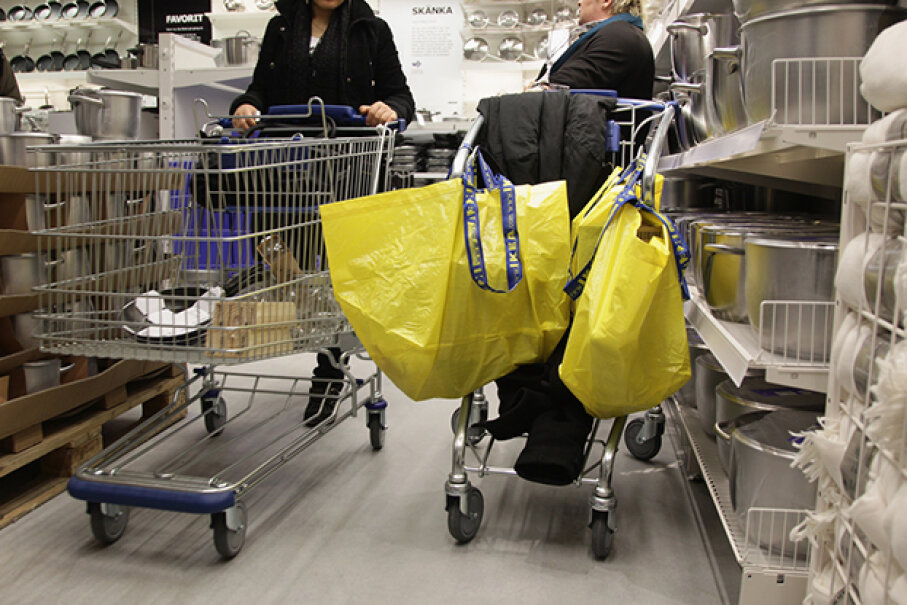
Find the location of `frying pans`. frying pans is located at coordinates (179, 302).